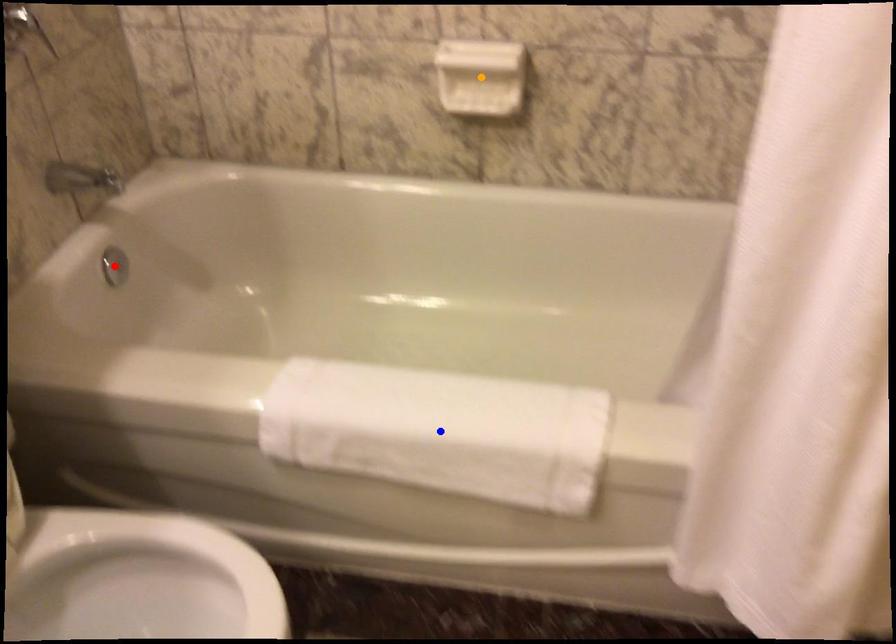
Order these from nearest to farthest:
1. red point
2. blue point
3. orange point

blue point → orange point → red point